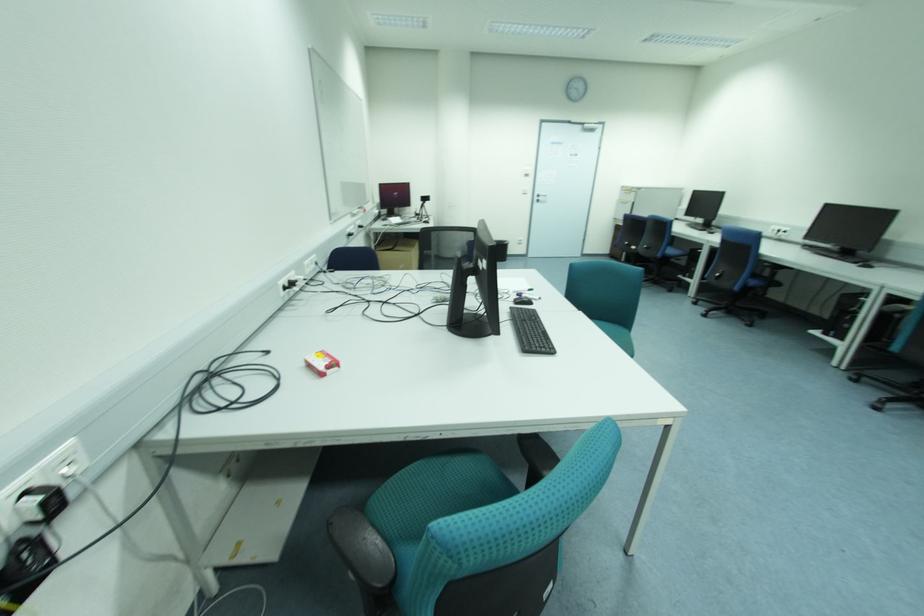
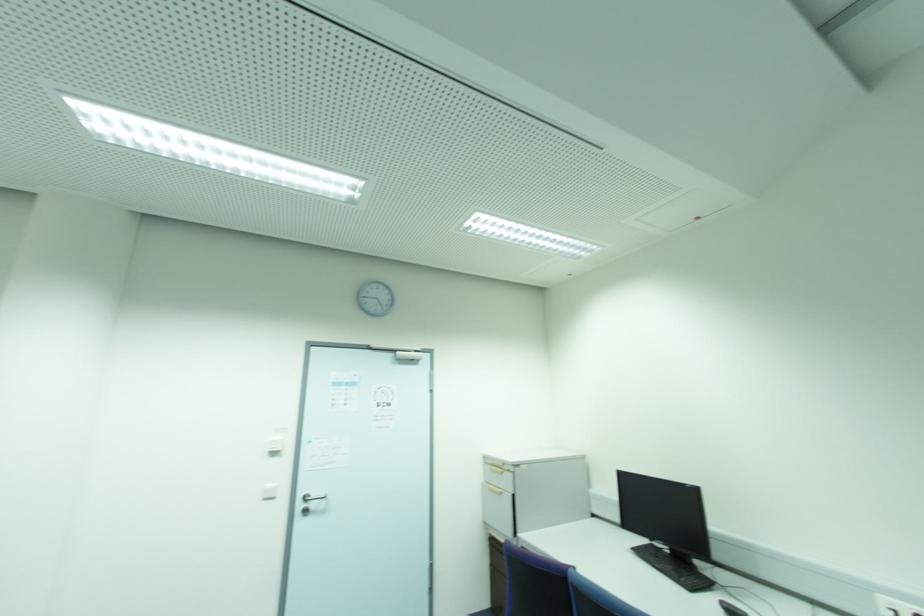
The point at (x=526, y=176) is marked in the first image. Where is the corresponding point in the second image?

(274, 454)